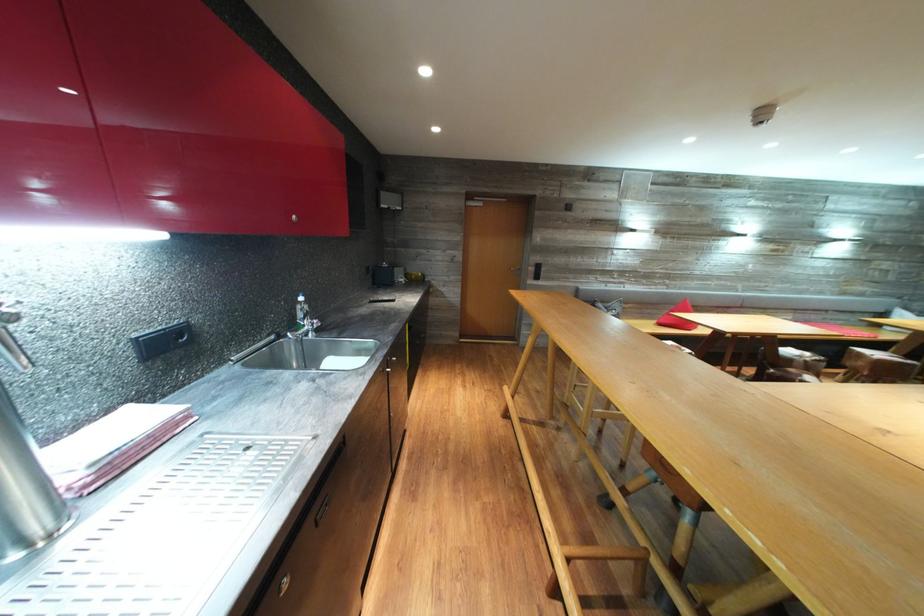
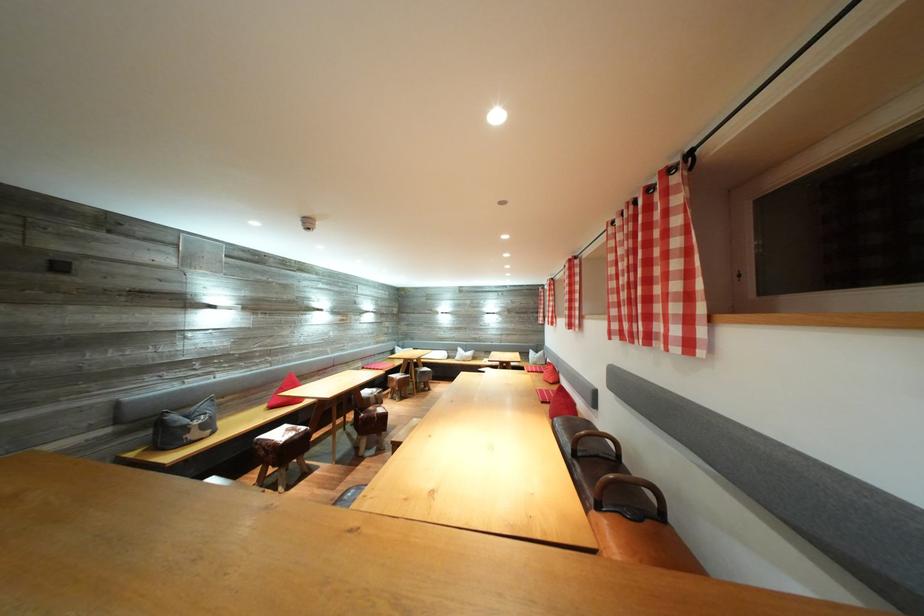
The point at (x=883, y=351) is marked in the first image. Where is the corresponding point in the second image?

(403, 376)